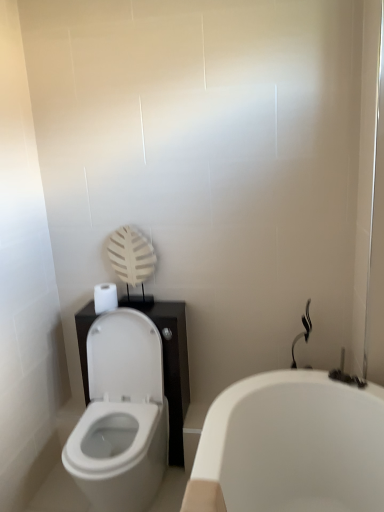
Question: Is white glossy bathtub at lower right at the left side of white glossy toilet at lower left?

Choices:
 (A) yes
 (B) no

Answer: (B)

Question: Is white glossy bathtub at lower right outside of white glossy toilet at lower left?

Choices:
 (A) yes
 (B) no

Answer: (A)

Question: Can you confirm if white glossy bathtub at lower right is thinner than white glossy toilet at lower left?

Choices:
 (A) no
 (B) yes

Answer: (A)

Question: Considering the relative sizes of white glossy bathtub at lower right and white glossy toilet at lower left in the image provided, is white glossy bathtub at lower right smaller than white glossy toilet at lower left?

Choices:
 (A) no
 (B) yes

Answer: (A)

Question: Can you confirm if white glossy bathtub at lower right is bigger than white glossy toilet at lower left?

Choices:
 (A) yes
 (B) no

Answer: (A)

Question: Is the position of white glossy bathtub at lower right more distant than that of white glossy toilet at lower left?

Choices:
 (A) no
 (B) yes

Answer: (A)

Question: Considering the relative sizes of white matte toilet paper at left and black glossy shower at right in the image provided, is white matte toilet paper at left thinner than black glossy shower at right?

Choices:
 (A) no
 (B) yes

Answer: (A)

Question: Is white matte toilet paper at left closer to camera compared to black glossy shower at right?

Choices:
 (A) yes
 (B) no

Answer: (B)

Question: Considering the relative sizes of white matte toilet paper at left and black glossy shower at right in the image provided, is white matte toilet paper at left taller than black glossy shower at right?

Choices:
 (A) yes
 (B) no

Answer: (B)

Question: Is white matte toilet paper at left not near black glossy shower at right?

Choices:
 (A) no
 (B) yes

Answer: (A)

Question: Considering the relative positions of white matte toilet paper at left and black glossy shower at right in the image provided, is white matte toilet paper at left to the left of black glossy shower at right from the viewer's perspective?

Choices:
 (A) yes
 (B) no

Answer: (A)

Question: Does white matte toilet paper at left have a larger size compared to black glossy shower at right?

Choices:
 (A) yes
 (B) no

Answer: (B)

Question: From a real-world perspective, is white glossy toilet at lower left below white glossy bathtub at lower right?

Choices:
 (A) yes
 (B) no

Answer: (B)